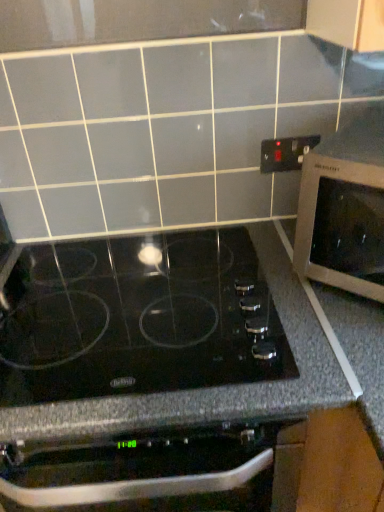
In order to face black plastic electrical outlet at upper right, should I rotate leftwards or rightwards?

Turn right by 13.063 degrees to look at black plastic electrical outlet at upper right.

You are a GUI agent. You are given a task and a screenshot of the screen. Output one action in this format:
    pyautogui.click(x=<x>, y=<y>)
    Task: Click on the black glass cooktop at center
    
    Given the screenshot: What is the action you would take?
    pyautogui.click(x=177, y=376)

At what (x,y) coordinates should I click in order to perform the action: click on black plastic electrical outlet at upper right. Please return your answer as a coordinate pair (x, y). This screenshot has height=512, width=384. Looking at the image, I should click on (285, 153).

From the image's perspective, is silver metallic microwave at right beneath black glass cooktop at center?

No, from the image's perspective, silver metallic microwave at right is not beneath black glass cooktop at center.

Is point (316, 152) farther from viewer compared to point (281, 373)?

Yes, it is.

From a real-world perspective, is silver metallic microwave at right over black glass cooktop at center?

Indeed, from a real-world perspective, silver metallic microwave at right stands above black glass cooktop at center.

Would you say silver metallic microwave at right contains black glass cooktop at center?

Definitely not — black glass cooktop at center is not inside silver metallic microwave at right.

The image size is (384, 512). Find the location of `electric outlet above the silver metallic microwave at right (from a real-world perspective)`. electric outlet above the silver metallic microwave at right (from a real-world perspective) is located at coordinates (285, 153).

From the image's perspective, which one is positioned lower, silver metallic microwave at right or black plastic electrical outlet at upper right?

From the image's view, silver metallic microwave at right is below.

How many degrees apart are the facing directions of silver metallic microwave at right and black plastic electrical outlet at upper right?

There is a 42.4-degree angle between the facing directions of silver metallic microwave at right and black plastic electrical outlet at upper right.

Is silver metallic microwave at right completely or partially outside of black plastic electrical outlet at upper right?

Yes, silver metallic microwave at right is not within black plastic electrical outlet at upper right.

The image size is (384, 512). In order to click on counter in front of the silver metallic microwave at right in this screenshot , I will do `click(177, 376)`.

From the image's perspective, which is below, black glass cooktop at center or silver metallic microwave at right?

black glass cooktop at center appears lower in the image.

How far apart are black glass cooktop at center and silver metallic microwave at right?

30.91 centimeters.

From a real-world perspective, is black glass cooktop at center positioned above or below silver metallic microwave at right?

In terms of real-world spatial position, black glass cooktop at center is below silver metallic microwave at right.

Are black glass cooktop at center and black plastic electrical outlet at upper right making contact?

black glass cooktop at center and black plastic electrical outlet at upper right are not in contact.

Image resolution: width=384 pixels, height=512 pixels. I want to click on counter on the left of the black plastic electrical outlet at upper right, so click(x=177, y=376).

Which of these two, black glass cooktop at center or black plastic electrical outlet at upper right, stands taller?

With more height is black glass cooktop at center.

Is black plastic electrical outlet at upper right completely or partially inside black glass cooktop at center?

No, black glass cooktop at center does not contain black plastic electrical outlet at upper right.

Between black plastic electrical outlet at upper right and silver metallic microwave at right, which one has more height?

silver metallic microwave at right is taller.

Which is closer to the camera, (295, 169) or (312, 247)?

Point (295, 169) is farther from the camera than point (312, 247).

Considering the positions of objects black plastic electrical outlet at upper right and silver metallic microwave at right in the image provided, who is more to the left, black plastic electrical outlet at upper right or silver metallic microwave at right?

black plastic electrical outlet at upper right.

Is silver metallic microwave at right surrounded by black plastic electrical outlet at upper right?

Actually, silver metallic microwave at right is outside black plastic electrical outlet at upper right.

From the image's perspective, between black plastic electrical outlet at upper right and black glass cooktop at center, who is located below?

From the image's view, black glass cooktop at center is below.

From a real-world perspective, is black plastic electrical outlet at upper right on black glass cooktop at center?

Yes, from a real-world perspective, black plastic electrical outlet at upper right is above black glass cooktop at center.

Which object is wider, black plastic electrical outlet at upper right or black glass cooktop at center?

black glass cooktop at center.

From the picture: Would you consider black plastic electrical outlet at upper right to be distant from black glass cooktop at center?

No, there isn't a large distance between black plastic electrical outlet at upper right and black glass cooktop at center.

Locate an element on the screen. The height and width of the screenshot is (512, 384). counter directly beneath the silver metallic microwave at right (from a real-world perspective) is located at coordinates (177, 376).

Where is `electric outlet behind the silver metallic microwave at right`? The height and width of the screenshot is (512, 384). electric outlet behind the silver metallic microwave at right is located at coordinates (285, 153).

When comparing their distances from black plastic electrical outlet at upper right, does black glass cooktop at center or silver metallic microwave at right seem further?

black glass cooktop at center lies further to black plastic electrical outlet at upper right than the other object.

From the image, which object appears to be farther from silver metallic microwave at right, black plastic electrical outlet at upper right or black glass cooktop at center?

black plastic electrical outlet at upper right.

Based on their spatial positions, is silver metallic microwave at right or black plastic electrical outlet at upper right closer to black glass cooktop at center?

silver metallic microwave at right.

From the image, which object appears to be nearer to black glass cooktop at center, black plastic electrical outlet at upper right or silver metallic microwave at right?

silver metallic microwave at right.

Considering their positions, is black glass cooktop at center positioned further to silver metallic microwave at right than black plastic electrical outlet at upper right?

black plastic electrical outlet at upper right.

From the image, which object appears to be nearer to black plastic electrical outlet at upper right, silver metallic microwave at right or black glass cooktop at center?

The object closer to black plastic electrical outlet at upper right is silver metallic microwave at right.

You are a GUI agent. You are given a task and a screenshot of the screen. Output one action in this format:
    pyautogui.click(x=<x>, y=<y>)
    Task: Click on the microwave oven between black plastic electrical outlet at upper right and black glass cooktop at center in the up-down direction
    The width and height of the screenshot is (384, 512).
    Given the screenshot: What is the action you would take?
    pyautogui.click(x=344, y=209)